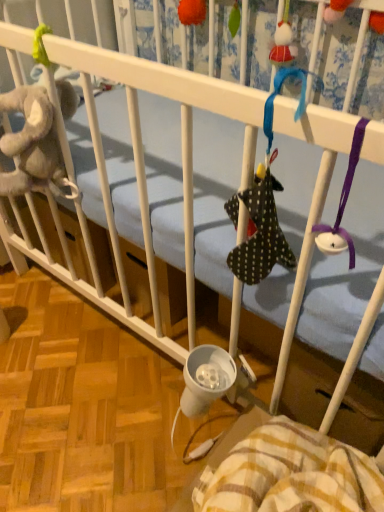
Question: Considering the positions of orange fuzzy ball at upper center, the first toy positioned from the left, and yellow plaid blanket at lower right in the image, is orange fuzzy ball at upper center, the first toy positioned from the left, wider or thinner than yellow plaid blanket at lower right?

Choices:
 (A) thin
 (B) wide

Answer: (A)

Question: Would you say orange fuzzy ball at upper center, marked as the second toy in a right-to-left arrangement, is inside or outside yellow plaid blanket at lower right?

Choices:
 (A) inside
 (B) outside

Answer: (B)

Question: Considering the real-world distances, which object is closest to the orange fuzzy ball at upper center, which is counted as the 1th toy, starting from the top?

Choices:
 (A) yellow plaid blanket at lower right
 (B) polka dot fabric sock at upper center, the second toy positioned from the top

Answer: (B)

Question: Considering the real-world distances, which object is closest to the orange fuzzy ball at upper center, the first toy from the back?

Choices:
 (A) polka dot fabric sock at upper center, the second toy from the left
 (B) yellow plaid blanket at lower right

Answer: (A)